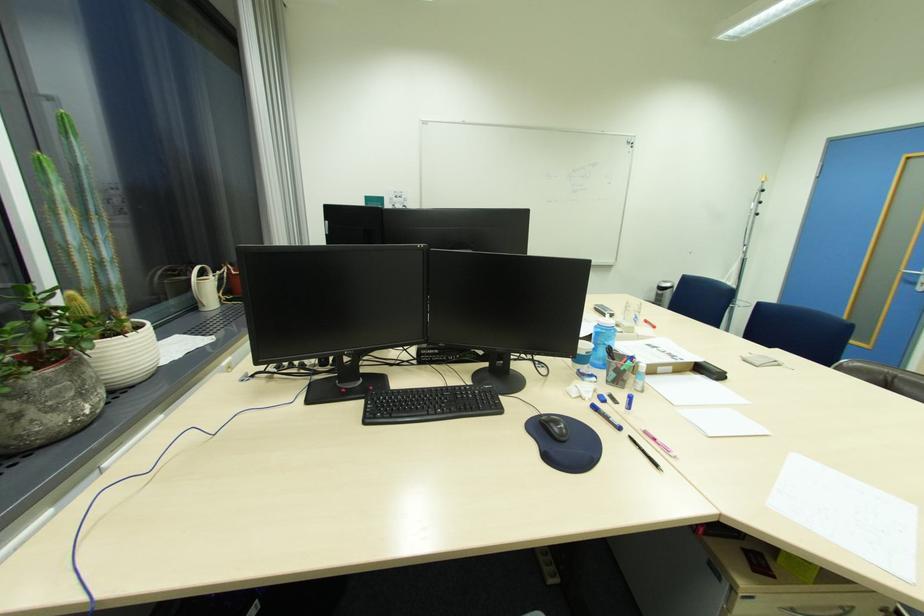
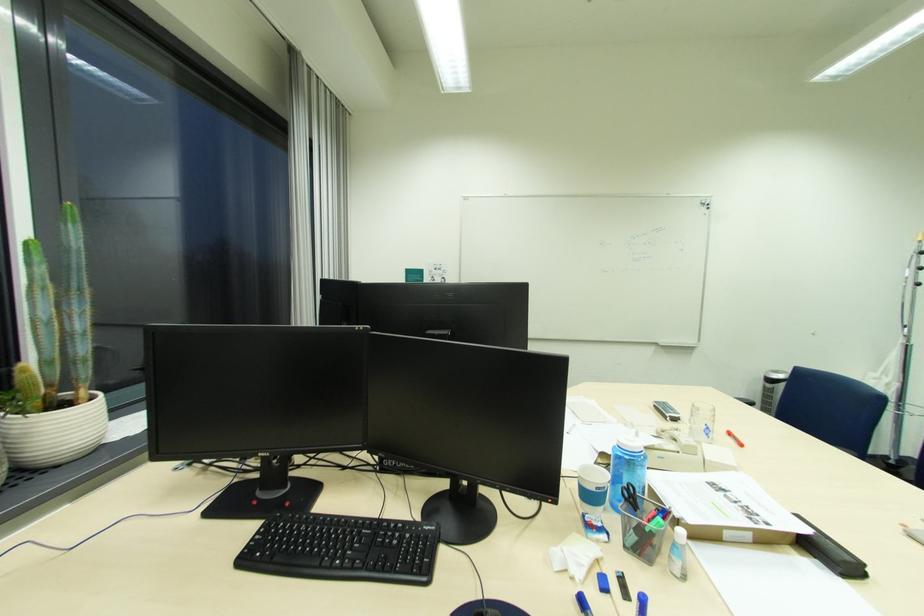
In the second image, find the point that corresponds to the point at 671,283 in the first image.

(782, 373)